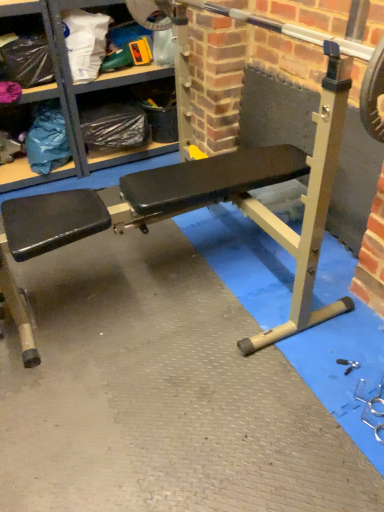
Image resolution: width=384 pixels, height=512 pixels. I want to click on matte plastic shelf at upper left, so coord(71,96).

The image size is (384, 512). What do you see at coordinates (71, 96) in the screenshot? I see `matte plastic shelf at upper left` at bounding box center [71, 96].

The image size is (384, 512). In order to click on metallic silver barbell at center in this screenshot , I will do (285, 35).

The width and height of the screenshot is (384, 512). What do you see at coordinates (285, 35) in the screenshot? I see `metallic silver barbell at center` at bounding box center [285, 35].

The height and width of the screenshot is (512, 384). What are the coordinates of `matte plastic shelf at upper left` in the screenshot? It's located at (71, 96).

Does matte plastic shelf at upper left appear on the right side of metallic silver barbell at center?

No.

Based on the photo, between matte plastic shelf at upper left and metallic silver barbell at center, which one is positioned in front?

metallic silver barbell at center is in front.

Considering the positions of points (14, 14) and (173, 13), is point (14, 14) closer to camera compared to point (173, 13)?

No, it is not.

From the image's perspective, is matte plastic shelf at upper left located beneath metallic silver barbell at center?

No, from the image's perspective, matte plastic shelf at upper left is not beneath metallic silver barbell at center.

From a real-world perspective, is matte plastic shelf at upper left positioned above or below metallic silver barbell at center?

From a real-world perspective, matte plastic shelf at upper left is physically below metallic silver barbell at center.

Between matte plastic shelf at upper left and metallic silver barbell at center, which one has smaller width?

With smaller width is metallic silver barbell at center.

Can you confirm if matte plastic shelf at upper left is taller than metallic silver barbell at center?

Yes, matte plastic shelf at upper left is taller than metallic silver barbell at center.

Considering the sizes of objects matte plastic shelf at upper left and metallic silver barbell at center in the image provided, who is bigger, matte plastic shelf at upper left or metallic silver barbell at center?

matte plastic shelf at upper left.

Choose the correct answer: Is matte plastic shelf at upper left inside metallic silver barbell at center or outside it?

matte plastic shelf at upper left is spatially situated outside metallic silver barbell at center.

Is matte plastic shelf at upper left far from metallic silver barbell at center?

No, matte plastic shelf at upper left is not far away from metallic silver barbell at center.

Could you tell me if matte plastic shelf at upper left is turned towards metallic silver barbell at center?

Yes, matte plastic shelf at upper left faces towards metallic silver barbell at center.

What's the angular difference between matte plastic shelf at upper left and metallic silver barbell at center's facing directions?

There is a 88.6-degree angle between the facing directions of matte plastic shelf at upper left and metallic silver barbell at center.

This screenshot has width=384, height=512. I want to click on shelf that appears below the metallic silver barbell at center (from a real-world perspective), so click(71, 96).

Which is more to the left, metallic silver barbell at center or matte plastic shelf at upper left?

From the viewer's perspective, matte plastic shelf at upper left appears more on the left side.

Which object is further away from the camera taking this photo, metallic silver barbell at center or matte plastic shelf at upper left?

matte plastic shelf at upper left.

Which point is more distant from viewer, (134, 0) or (8, 182)?

The point (8, 182) is farther.

From the image's perspective, is metallic silver barbell at center positioned above or below matte plastic shelf at upper left?

From the image's perspective, metallic silver barbell at center appears below matte plastic shelf at upper left.

From a real-world perspective, which is physically below, metallic silver barbell at center or matte plastic shelf at upper left?

From a 3D spatial view, matte plastic shelf at upper left is below.

Does metallic silver barbell at center have a lesser width compared to matte plastic shelf at upper left?

Yes, metallic silver barbell at center is thinner than matte plastic shelf at upper left.

Which of these two, metallic silver barbell at center or matte plastic shelf at upper left, stands shorter?

metallic silver barbell at center is shorter.

Can you confirm if metallic silver barbell at center is bigger than matte plastic shelf at upper left?

Incorrect, metallic silver barbell at center is not larger than matte plastic shelf at upper left.

From the picture: Is metallic silver barbell at center located outside matte plastic shelf at upper left?

Absolutely, metallic silver barbell at center is external to matte plastic shelf at upper left.

Based on the photo, are metallic silver barbell at center and matte plastic shelf at upper left located far from each other?

No, there isn't a large distance between metallic silver barbell at center and matte plastic shelf at upper left.

Could you tell me if metallic silver barbell at center is turned towards matte plastic shelf at upper left?

No, metallic silver barbell at center is not oriented towards matte plastic shelf at upper left.

Measure the distance from metallic silver barbell at center to matte plastic shelf at upper left.

65.59 centimeters.

There is a matte plastic shelf at upper left. Where is `barbell above it (from a real-world perspective)`? barbell above it (from a real-world perspective) is located at coordinates (285, 35).

At what (x,y) coordinates should I click in order to perform the action: click on barbell above the matte plastic shelf at upper left (from a real-world perspective). Please return your answer as a coordinate pair (x, y). Looking at the image, I should click on (285, 35).

This screenshot has height=512, width=384. I want to click on barbell that appears on the right of matte plastic shelf at upper left, so click(285, 35).